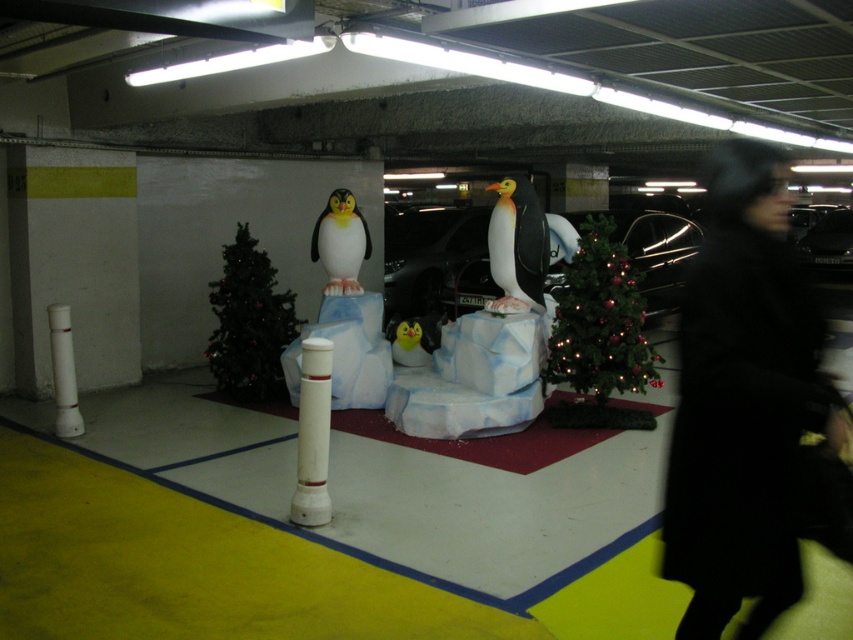
Question: Can you confirm if white plastic pole at left is bigger than yellow matte penguin at center?

Choices:
 (A) yes
 (B) no

Answer: (B)

Question: Among these objects, which one is nearest to the camera?

Choices:
 (A) glossy black car at center
 (B) yellow matte penguin at center

Answer: (B)

Question: From the image, what is the correct spatial relationship of white glossy penguin at center in relation to white plastic pole at left?

Choices:
 (A) right
 (B) left

Answer: (A)

Question: Among these objects, which one is farthest from the camera?

Choices:
 (A) glossy black car at center
 (B) white plastic pole at left

Answer: (A)

Question: Considering the relative positions of white matte penguin at center and white glossy penguin at center in the image provided, where is white matte penguin at center located with respect to white glossy penguin at center?

Choices:
 (A) left
 (B) right

Answer: (B)

Question: Among these points, which one is nearest to the camera?

Choices:
 (A) (764, 326)
 (B) (403, 220)
 (C) (297, 486)
 (D) (498, 268)

Answer: (A)